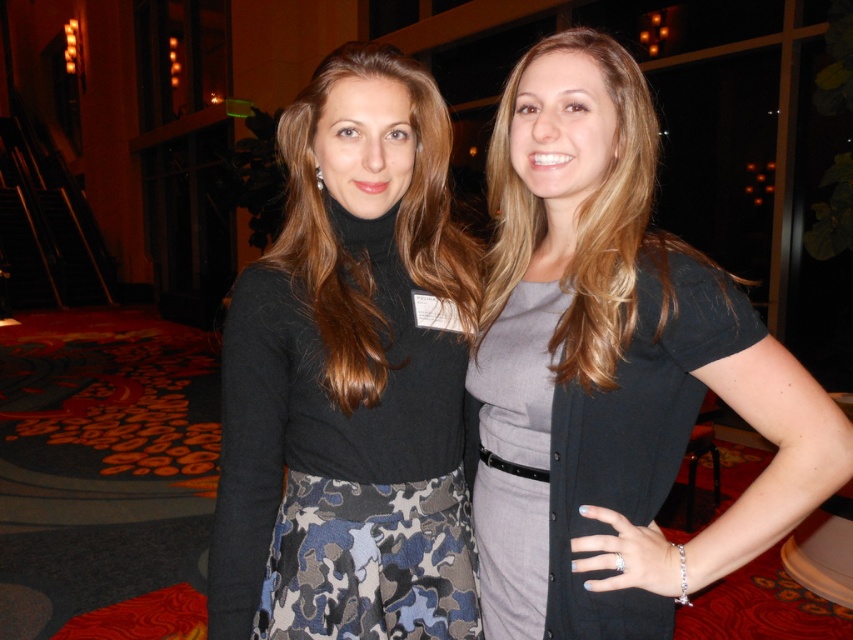
Looking at this image, does matte black turtleneck sweater at center have a larger size compared to gray matte dress at center?

Correct, matte black turtleneck sweater at center is larger in size than gray matte dress at center.

Is point (422, 125) closer to camera compared to point (572, 529)?

No, it is not.

Identify the location of matte black turtleneck sweater at center. This screenshot has width=853, height=640. (349, 378).

Which is behind, point (424, 506) or point (532, 224)?

Point (532, 224)

Which is above, matte black turtleneck sweater at center or matte gray dress at center?

matte gray dress at center is higher up.

The width and height of the screenshot is (853, 640). Find the location of `matte black turtleneck sweater at center`. matte black turtleneck sweater at center is located at coordinates (349, 378).

Is gray matte dress at center above matte gray dress at center?

No, gray matte dress at center is not above matte gray dress at center.

Does gray matte dress at center lie behind matte gray dress at center?

No.

You are a GUI agent. You are given a task and a screenshot of the screen. Output one action in this format:
    pyautogui.click(x=<x>, y=<y>)
    Task: Click on the gray matte dress at center
    
    Given the screenshot: What is the action you would take?
    pyautogui.click(x=634, y=442)

Locate an element on the screen. Image resolution: width=853 pixels, height=640 pixels. gray matte dress at center is located at coordinates (634, 442).